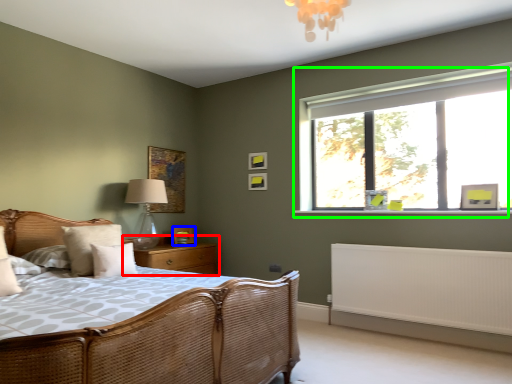
Question: Based on their relative distances, which object is nearer to nightstand (highlighted by a red box)? Choose from picture frame (highlighted by a blue box) and window (highlighted by a green box).

Choices:
 (A) picture frame
 (B) window

Answer: (A)